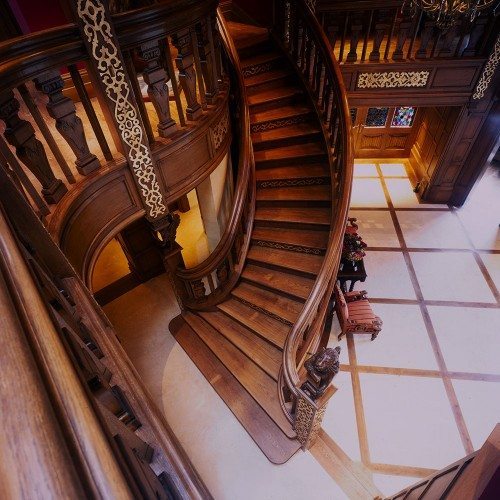
I want to click on right handrail, so click(317, 292).